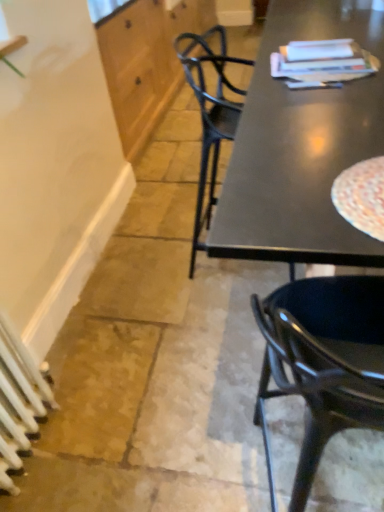
I want to click on free space to the back side of white metallic radiator at lower left, so click(x=73, y=370).